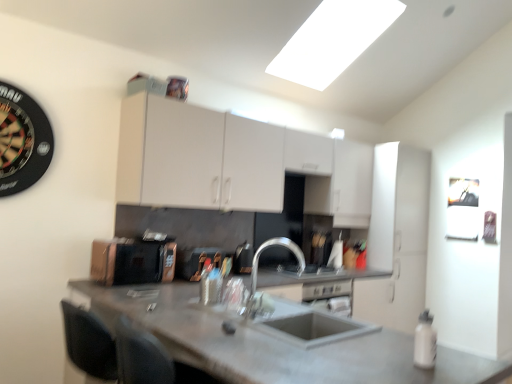
Identify the location of unoccupied space behind silver metallic faucet at center. (282, 315).